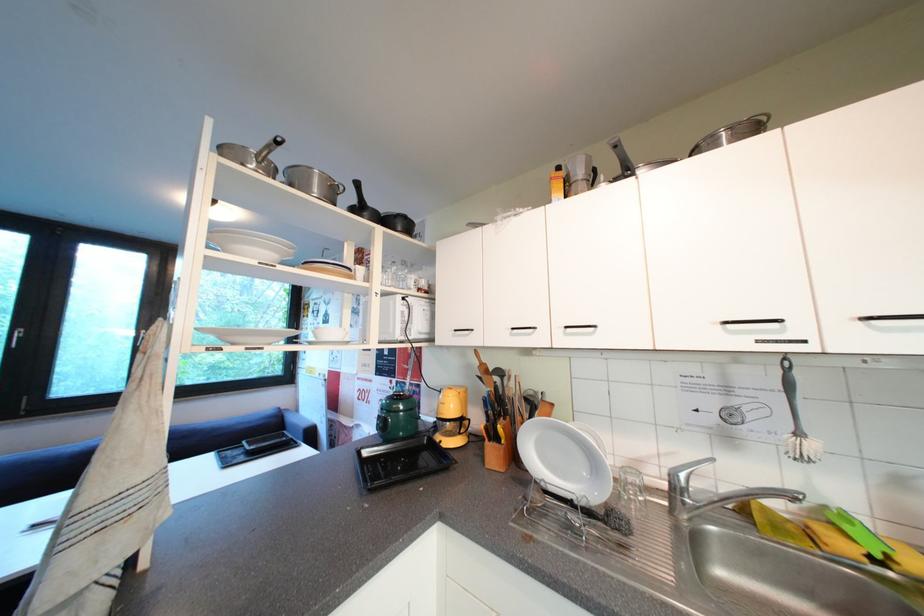
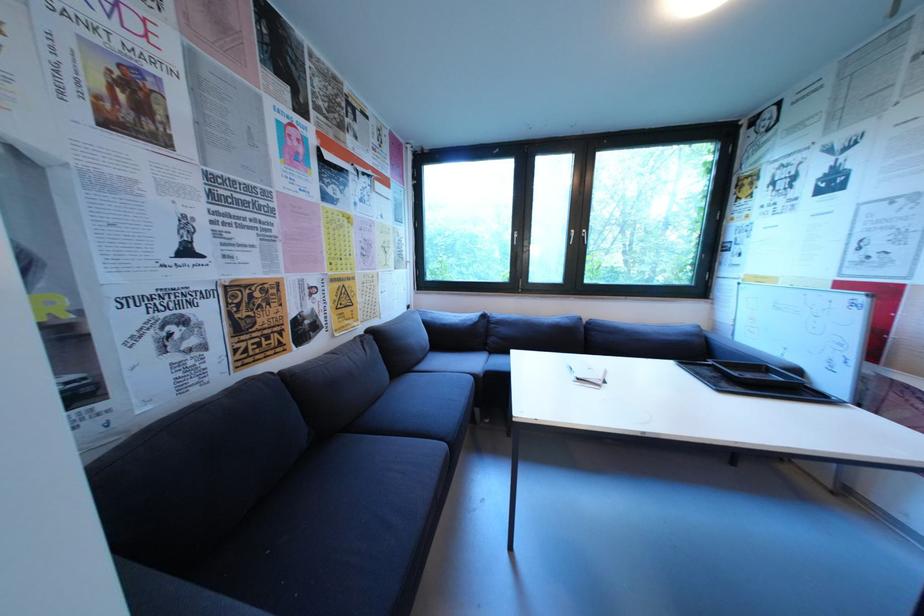
In the second image, find the point that corresponds to point 237,454 in the first image.

(699, 369)